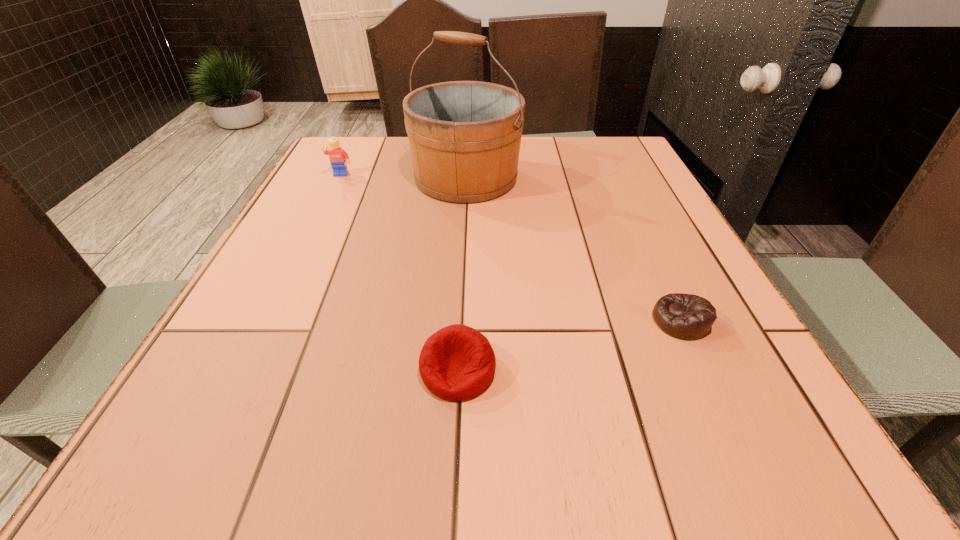
At what (x,y) coordinates should I click in order to perform the action: click on vacant space in between the shorter beanbag and the tallest object. Please return your answer as a coordinate pair (x, y). This screenshot has width=960, height=540. Looking at the image, I should click on (573, 249).

I want to click on vacant area that lies between the third shortest object and the right beanbag, so click(x=511, y=248).

Locate an element on the screen. This screenshot has width=960, height=540. object that is the second closest to the tallest object is located at coordinates (684, 316).

You are a GUI agent. You are given a task and a screenshot of the screen. Output one action in this format:
    pyautogui.click(x=<x>, y=<y>)
    Task: Click on the second closest object to the left beanbag
    
    Given the screenshot: What is the action you would take?
    pyautogui.click(x=464, y=136)

Find the location of `vacant area in the image that satisfies the following two spatial constraints: 1. on the face of the shorter beanbag; 2. on the left side of the third shortest object`. vacant area in the image that satisfies the following two spatial constraints: 1. on the face of the shorter beanbag; 2. on the left side of the third shortest object is located at coordinates (271, 320).

Identify the location of free spot that satisfies the following two spatial constraints: 1. on the face of the second tallest object; 2. on the left side of the shorter beanbag. (271, 320).

Find the location of a particular element. blank area in the image that satisfies the following two spatial constraints: 1. on the face of the shorter beanbag; 2. on the left side of the leftmost object is located at coordinates (271, 320).

Where is `vacant space that satisfies the following two spatial constraints: 1. on the face of the shortest object; 2. on the left side of the leftmost object`? This screenshot has width=960, height=540. vacant space that satisfies the following two spatial constraints: 1. on the face of the shortest object; 2. on the left side of the leftmost object is located at coordinates (271, 320).